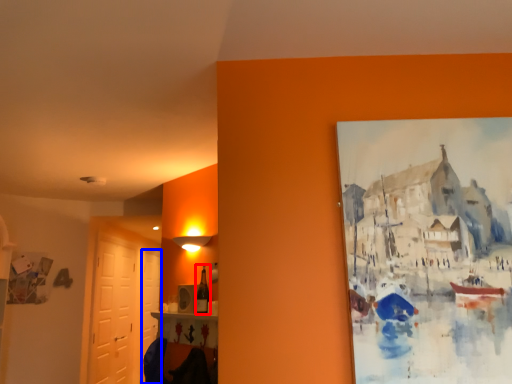
Question: Which object appears closest to the camera in this image, bottle (highlighted by a red box) or door (highlighted by a blue box)?

Choices:
 (A) bottle
 (B) door

Answer: (A)